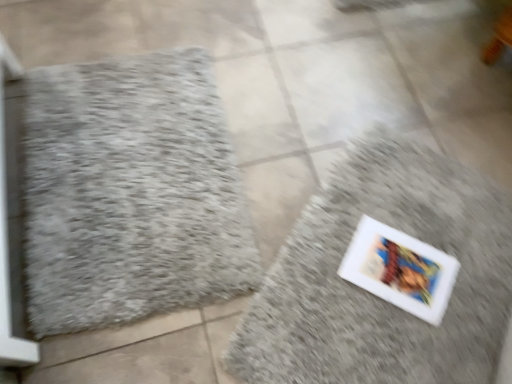
Question: Is point (188, 190) closer or farther from the camera than point (331, 279)?

Choices:
 (A) farther
 (B) closer

Answer: (A)

Question: Relative to white matte book at lower right, the first bath mat from the right, is gray fluffy bath mat at left, the 2th bath mat when ordered from right to left, in front or behind?

Choices:
 (A) front
 (B) behind

Answer: (B)

Question: Is gray fluffy bath mat at left, the 2th bath mat when ordered from right to left, bigger or smaller than white matte book at lower right, marked as the second bath mat in a left-to-right arrangement?

Choices:
 (A) small
 (B) big

Answer: (A)

Question: From the image's perspective, is white matte book at lower right, marked as the second bath mat in a left-to-right arrangement, above or below gray fluffy bath mat at left, which appears as the 1th bath mat when viewed from the left?

Choices:
 (A) below
 (B) above

Answer: (A)

Question: From their relative heights in the image, would you say white matte book at lower right, marked as the second bath mat in a left-to-right arrangement, is taller or shorter than gray fluffy bath mat at left, which appears as the 1th bath mat when viewed from the left?

Choices:
 (A) tall
 (B) short

Answer: (A)

Question: In the image, is white matte book at lower right, the first bath mat from the right, positioned in front of or behind gray fluffy bath mat at left, which appears as the 1th bath mat when viewed from the left?

Choices:
 (A) behind
 (B) front

Answer: (B)

Question: Considering the positions of white matte book at lower right, the first bath mat from the right, and gray fluffy bath mat at left, the 2th bath mat when ordered from right to left, in the image, is white matte book at lower right, the first bath mat from the right, bigger or smaller than gray fluffy bath mat at left, the 2th bath mat when ordered from right to left,?

Choices:
 (A) small
 (B) big

Answer: (B)